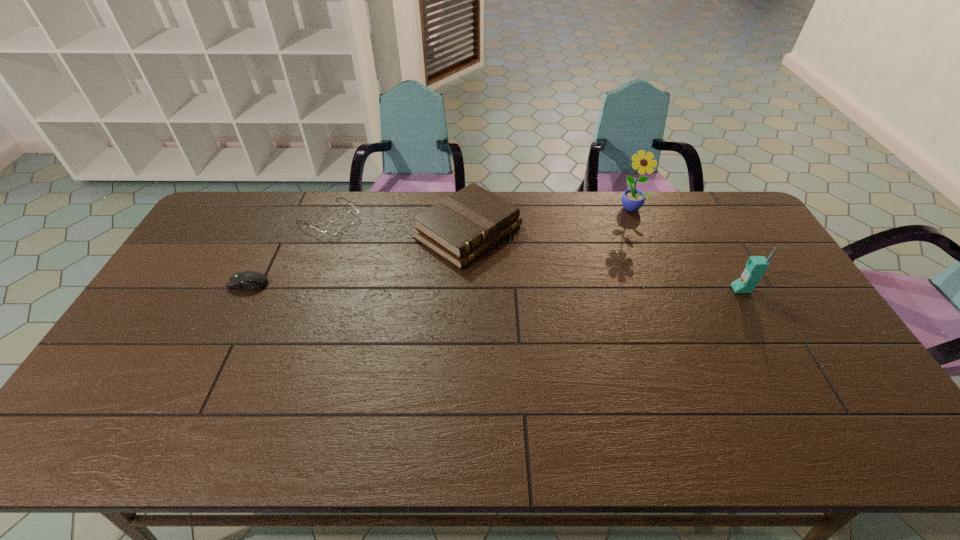
At what (x,y) coordinates should I click in order to perform the action: click on the second closest object relative to the computer equipment. Please return your answer as a coordinate pair (x, y). The image size is (960, 540). Looking at the image, I should click on [x=459, y=228].

Point out which object is positioned as the fourth nearest to the third tallest object. Please provide its 2D coordinates. Your answer should be formatted as a tuple, i.e. [(x, y)], where the tuple contains the x and y coordinates of a point satisfying the conditions above.

[(756, 266)]

The image size is (960, 540). What are the coordinates of `free location that satisfies the following two spatial constraints: 1. on the back side of the spectacles; 2. on the right side of the tallest object` in the screenshot? It's located at click(333, 207).